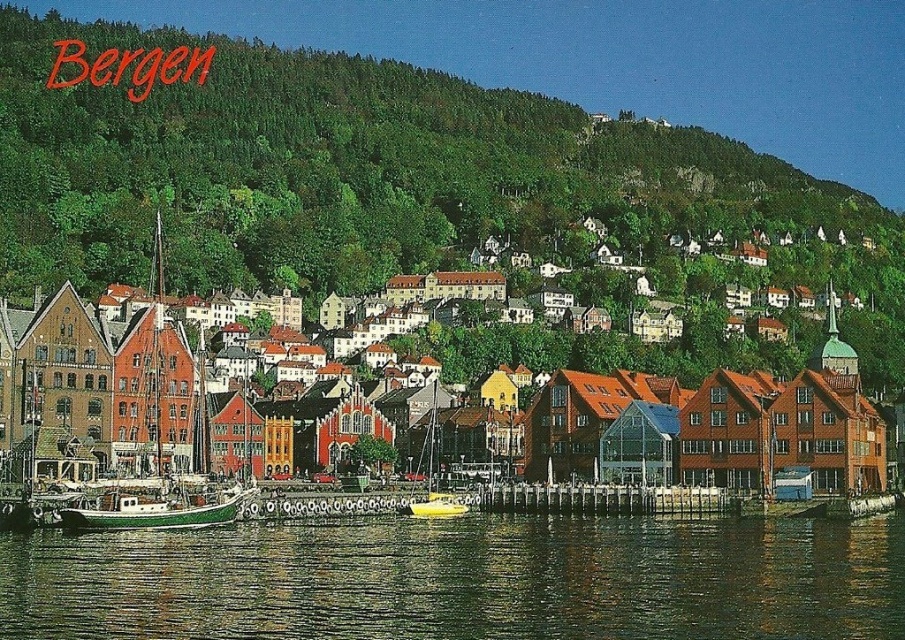
Question: Which point is closer to the camera taking this photo?

Choices:
 (A) click(427, 492)
 (B) click(449, 604)

Answer: (B)

Question: Can you confirm if green forested hillside at upper center is positioned above yellow matte sailboat at center?

Choices:
 (A) no
 (B) yes

Answer: (B)

Question: Can you confirm if green forested hillside at upper center is positioned to the right of yellow matte sailboat at center?

Choices:
 (A) yes
 (B) no

Answer: (A)

Question: Does green forested hillside at upper center come behind yellow matte sailboat at center?

Choices:
 (A) no
 (B) yes

Answer: (B)

Question: Which object is positioned closest to the brown wooden buildings at center?

Choices:
 (A) green reflective water at lower center
 (B) green forested hillside at upper center

Answer: (A)

Question: Which object is the closest to the green reflective water at lower center?

Choices:
 (A) green forested hillside at upper center
 (B) green matte boat at lower left

Answer: (B)